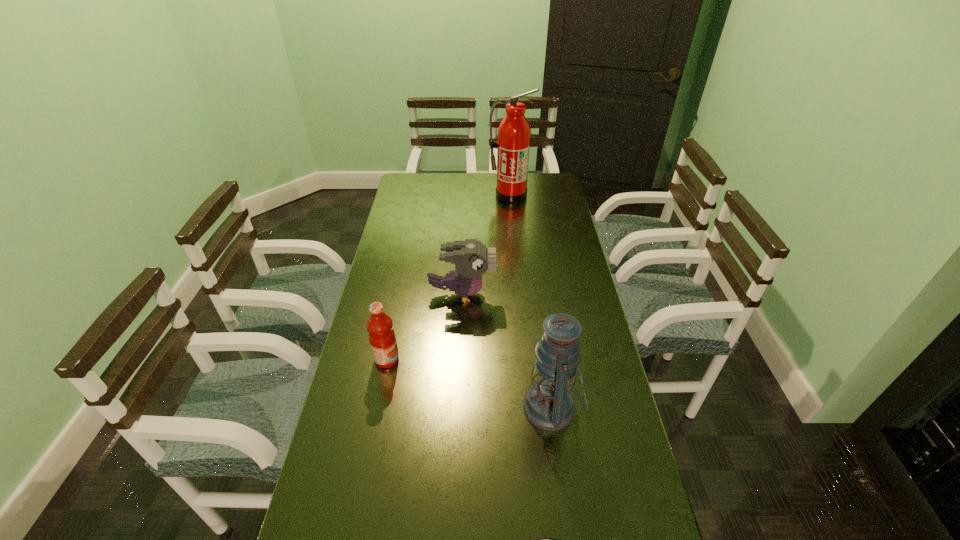
In order to click on the farthest object in this screenshot , I will do `click(514, 133)`.

You are a GUI agent. You are given a task and a screenshot of the screen. Output one action in this format:
    pyautogui.click(x=<x>, y=<y>)
    Task: Click on the fire extinguisher
    This screenshot has height=540, width=960.
    Given the screenshot: What is the action you would take?
    pyautogui.click(x=514, y=133)

You are a GUI agent. You are given a task and a screenshot of the screen. Output one action in this format:
    pyautogui.click(x=<x>, y=<y>)
    Task: Click on the fourth shortest object
    
    Given the screenshot: What is the action you would take?
    pyautogui.click(x=548, y=404)

Find the location of a particular element. The height and width of the screenshot is (540, 960). the fourth farthest object is located at coordinates (548, 404).

The image size is (960, 540). I want to click on fruit juice, so click(382, 338).

Find the location of a particular element. The width and height of the screenshot is (960, 540). the leftmost object is located at coordinates pos(382,338).

At what (x,y) coordinates should I click in order to perform the action: click on bird. Please return your answer as a coordinate pair (x, y). Looking at the image, I should click on (471, 258).

Find the location of `free space located 0.060m on the label side of the farthest object`. free space located 0.060m on the label side of the farthest object is located at coordinates (511, 211).

Find the location of a particular element. free space located on the front-facing side of the second nearest object is located at coordinates (465, 407).

This screenshot has height=540, width=960. What are the coordinates of `free space located on the front-facing side of the second nearest object` in the screenshot? It's located at (497, 407).